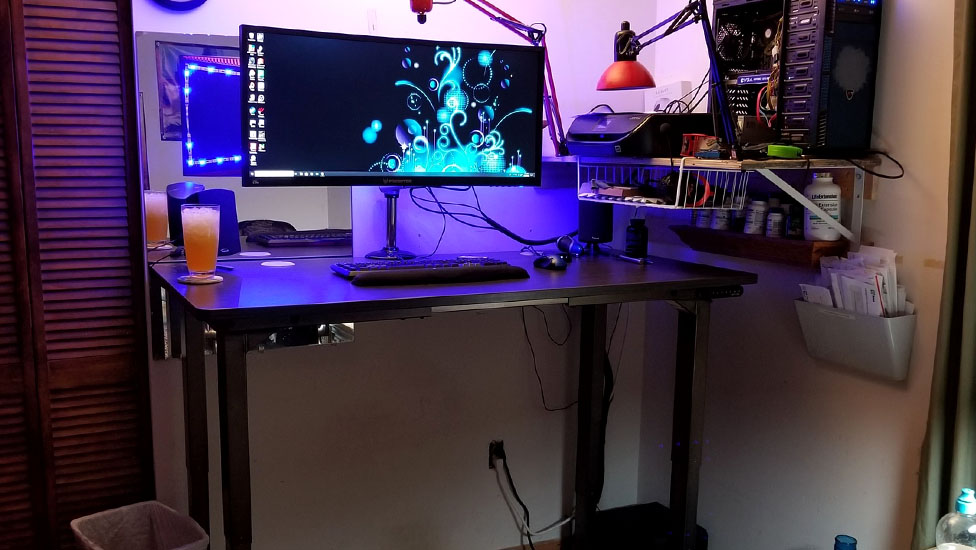
Locate an element on the screen. mirror is located at coordinates (264, 206).